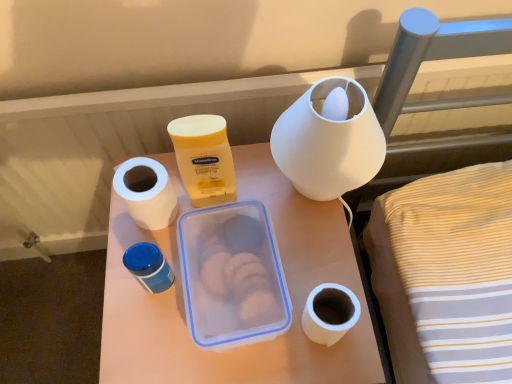
Image resolution: width=512 pixels, height=384 pixels. What do you see at coordinates (247, 345) in the screenshot?
I see `white plastic container at center` at bounding box center [247, 345].

Locate an element on the screen. white matte paper towel at left is located at coordinates (146, 192).

Describe the element at coordinates (328, 142) in the screenshot. I see `white matte lampshade at upper center, arranged as the 1th pottery when viewed from the right` at that location.

What do you see at coordinates (330, 313) in the screenshot? I see `white matte toilet paper at lower right` at bounding box center [330, 313].

Locate an element on the screen. The width and height of the screenshot is (512, 384). white plastic container at center is located at coordinates (247, 345).

Visually, is blue plastic container at center-left, which is counted as the first pottery, starting from the left, positioned to the left or to the right of white matte lampshade at upper center, which is counted as the 2th pottery, starting from the bottom?

blue plastic container at center-left, which is counted as the first pottery, starting from the left, is positioned on white matte lampshade at upper center, which is counted as the 2th pottery, starting from the bottom,'s left side.

Which object is further away from the camera, blue plastic container at center-left, which is the 1th pottery from bottom to top, or white matte lampshade at upper center, arranged as the second pottery when viewed from the left?

Positioned behind is blue plastic container at center-left, which is the 1th pottery from bottom to top.

In the image, there is a white matte lampshade at upper center, which is counted as the 2th pottery, starting from the bottom. Identify the location of pottery below it (from a real-world perspective). (148, 267).

From a real-world perspective, is white matte paper towel at left below yellow matte lotion at center?

Yes.

Considering the relative sizes of white matte paper towel at left and yellow matte lotion at center in the image provided, is white matte paper towel at left taller than yellow matte lotion at center?

No, white matte paper towel at left is not taller than yellow matte lotion at center.

In the scene shown: Can you tell me how much white matte paper towel at left and yellow matte lotion at center differ in facing direction?

They differ by 0.00214 degrees in their facing directions.

How distant is white matte paper towel at left from yellow matte lotion at center?

The distance of white matte paper towel at left from yellow matte lotion at center is 2.74 inches.

Considering the sizes of objects white plastic container at center and white matte lampshade at upper center, arranged as the second pottery when viewed from the left, in the image provided, who is smaller, white plastic container at center or white matte lampshade at upper center, arranged as the second pottery when viewed from the left,?

white matte lampshade at upper center, arranged as the second pottery when viewed from the left.

From the image's perspective, which object appears higher, white plastic container at center or white matte lampshade at upper center, arranged as the second pottery when viewed from the left?

From the image's view, white matte lampshade at upper center, arranged as the second pottery when viewed from the left, is above.

Can you confirm if white plastic container at center is wider than white matte lampshade at upper center, arranged as the 1th pottery when viewed from the right?

Indeed, white plastic container at center has a greater width compared to white matte lampshade at upper center, arranged as the 1th pottery when viewed from the right.

Is white plastic container at center facing towards white matte lampshade at upper center, arranged as the second pottery when viewed from the left?

No.

Is white matte paper towel at left located outside white plastic container at center?

Yes, white matte paper towel at left is located beyond the bounds of white plastic container at center.

Is white matte paper towel at left looking in the opposite direction of white plastic container at center?

No, white matte paper towel at left's orientation is not away from white plastic container at center.

Which object is wider, white matte paper towel at left or white plastic container at center?

With larger width is white plastic container at center.

Who is more distant, white matte paper towel at left or white plastic container at center?

white matte paper towel at left is further away from the camera.

From a real-world perspective, is white matte lampshade at upper center, the first pottery viewed from the top, located higher than white matte paper towel at left?

Indeed, from a real-world perspective, white matte lampshade at upper center, the first pottery viewed from the top, stands above white matte paper towel at left.

Which is less distant, (346, 85) or (158, 183)?

Point (346, 85)

From the picture: Does white matte lampshade at upper center, arranged as the second pottery when viewed from the left, have a lesser height compared to white matte paper towel at left?

No, white matte lampshade at upper center, arranged as the second pottery when viewed from the left, is not shorter than white matte paper towel at left.

From the image's perspective, is white matte lampshade at upper center, arranged as the second pottery when viewed from the left, under white matte paper towel at left?

No, from the image's perspective, white matte lampshade at upper center, arranged as the second pottery when viewed from the left, is not beneath white matte paper towel at left.

Looking at the image, does yellow matte lotion at center seem bigger or smaller compared to blue plastic container at center-left, which is the 1th pottery from bottom to top?

In the image, yellow matte lotion at center appears to be larger than blue plastic container at center-left, which is the 1th pottery from bottom to top.

From the image's perspective, between yellow matte lotion at center and blue plastic container at center-left, which appears as the 2th pottery when viewed from the right, which one is located above?

yellow matte lotion at center appears higher in the image.

Does point (234, 192) appear closer or farther from the camera than point (163, 259)?

Clearly, point (234, 192) is more distant from the camera than point (163, 259).

From the image's perspective, which pottery is the 1st one above the white plastic container at center? Please provide its 2D coordinates.

[(148, 267)]

Is white plastic container at center outside of blue plastic container at center-left, which is counted as the first pottery, starting from the left?

Yes.

Can you tell me how much white plastic container at center and blue plastic container at center-left, which is counted as the first pottery, starting from the left, differ in facing direction?

0.00181 degrees separate the facing orientations of white plastic container at center and blue plastic container at center-left, which is counted as the first pottery, starting from the left.

From a real-world perspective, which is physically below, white plastic container at center or blue plastic container at center-left, which is counted as the first pottery, starting from the left?

white plastic container at center is physically lower.

Locate an element on the screen. This screenshot has width=512, height=384. pottery below the white matte lampshade at upper center, arranged as the 1th pottery when viewed from the right (from the image's perspective) is located at coordinates (148, 267).

Locate an element on the screen. The width and height of the screenshot is (512, 384). paper towel that appears behind the yellow matte lotion at center is located at coordinates (146, 192).

Based on their spatial positions, is yellow matte lotion at center or white matte paper towel at left closer to blue plastic container at center-left, the second pottery viewed from the top?

white matte paper towel at left lies closer to blue plastic container at center-left, the second pottery viewed from the top, than the other object.

When comparing their distances from yellow matte lotion at center, does white matte paper towel at left or white matte lampshade at upper center, arranged as the second pottery when viewed from the left, seem further?

white matte lampshade at upper center, arranged as the second pottery when viewed from the left, is further to yellow matte lotion at center.

Based on their spatial positions, is white matte paper towel at left or yellow matte lotion at center further from blue plastic container at center-left, which is the 1th pottery from bottom to top?

The object further to blue plastic container at center-left, which is the 1th pottery from bottom to top, is yellow matte lotion at center.

Which object lies nearer to the anchor point yellow matte lotion at center, white matte toilet paper at lower right or white plastic container at center?

white plastic container at center is positioned closer to the anchor yellow matte lotion at center.

Which object lies nearer to the anchor point white plastic container at center, white matte paper towel at left or white matte lampshade at upper center, arranged as the 1th pottery when viewed from the right?

The object closer to white plastic container at center is white matte paper towel at left.

Considering their positions, is white matte paper towel at left positioned further to white plastic container at center than yellow matte lotion at center?

Among the two, white matte paper towel at left is located further to white plastic container at center.

Estimate the real-world distances between objects in this image. Which object is closer to white matte toilet paper at lower right, yellow matte lotion at center or white plastic container at center?

white plastic container at center is closer to white matte toilet paper at lower right.

Which object lies further to the anchor point white matte lampshade at upper center, arranged as the second pottery when viewed from the left, blue plastic container at center-left, the second pottery viewed from the top, or white matte paper towel at left?

Among the two, blue plastic container at center-left, the second pottery viewed from the top, is located further to white matte lampshade at upper center, arranged as the second pottery when viewed from the left.

The image size is (512, 384). What are the coordinates of `toilet paper between yellow matte lotion at center and white plastic container at center in the vertical direction` in the screenshot? It's located at (330, 313).

At what (x,y) coordinates should I click in order to perform the action: click on product between white matte paper towel at left and white matte toilet paper at lower right from left to right. Please return your answer as a coordinate pair (x, y). The height and width of the screenshot is (384, 512). Looking at the image, I should click on (204, 158).

The height and width of the screenshot is (384, 512). I want to click on toilet paper located between blue plastic container at center-left, which is the 1th pottery from bottom to top, and white matte lampshade at upper center, which is counted as the 2th pottery, starting from the bottom, in the left-right direction, so click(x=330, y=313).

You are a GUI agent. You are given a task and a screenshot of the screen. Output one action in this format:
    pyautogui.click(x=<x>, y=<y>)
    Task: Click on the product between blue plastic container at center-left, which is counted as the first pottery, starting from the left, and white matte lampshade at upper center, which is counted as the 2th pottery, starting from the bottom, from left to right
    The height and width of the screenshot is (384, 512).
    Given the screenshot: What is the action you would take?
    click(x=204, y=158)